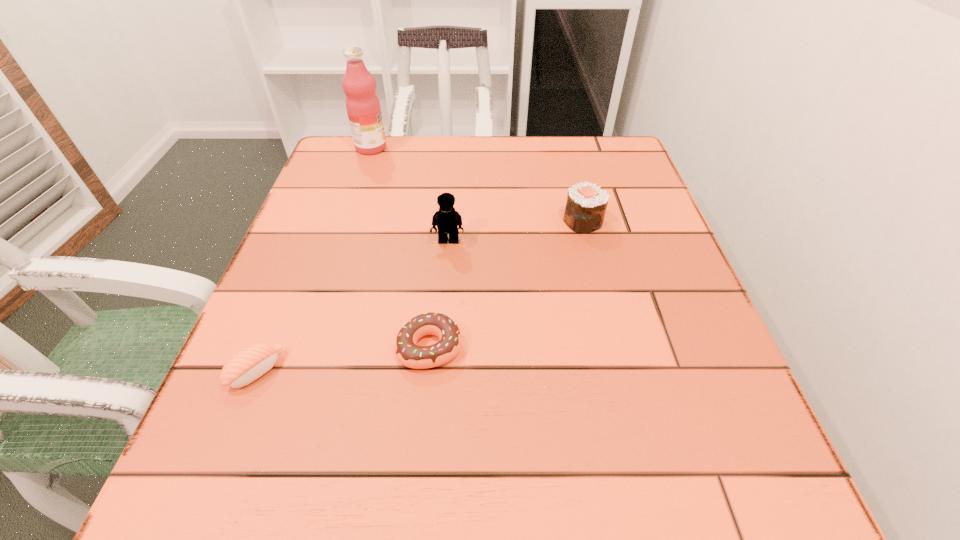
Where is `the tallest object`? The height and width of the screenshot is (540, 960). the tallest object is located at coordinates (363, 107).

You are a GUI agent. You are given a task and a screenshot of the screen. Output one action in this format:
    pyautogui.click(x=<x>, y=<y>)
    Task: Click on the farthest object
    This screenshot has width=960, height=540.
    Given the screenshot: What is the action you would take?
    pyautogui.click(x=363, y=107)

The height and width of the screenshot is (540, 960). I want to click on Lego, so click(x=448, y=221).

Find the location of a particular element. This screenshot has width=960, height=540. the third shortest object is located at coordinates (586, 204).

Find the location of a particular element. the rightmost object is located at coordinates (586, 204).

The image size is (960, 540). I want to click on the left sushi, so click(249, 364).

Find the location of a particular element. This screenshot has height=540, width=960. the shorter sushi is located at coordinates (249, 364).

Locate an element on the screen. doughnut is located at coordinates 409,354.

In order to click on free space located 0.160m on the label of the tallest object in this screenshot , I will do `click(448, 148)`.

At what (x,y) coordinates should I click in order to perform the action: click on vacant space located on the front-facing side of the Lego. Please return your answer as a coordinate pair (x, y). Looking at the image, I should click on 434,438.